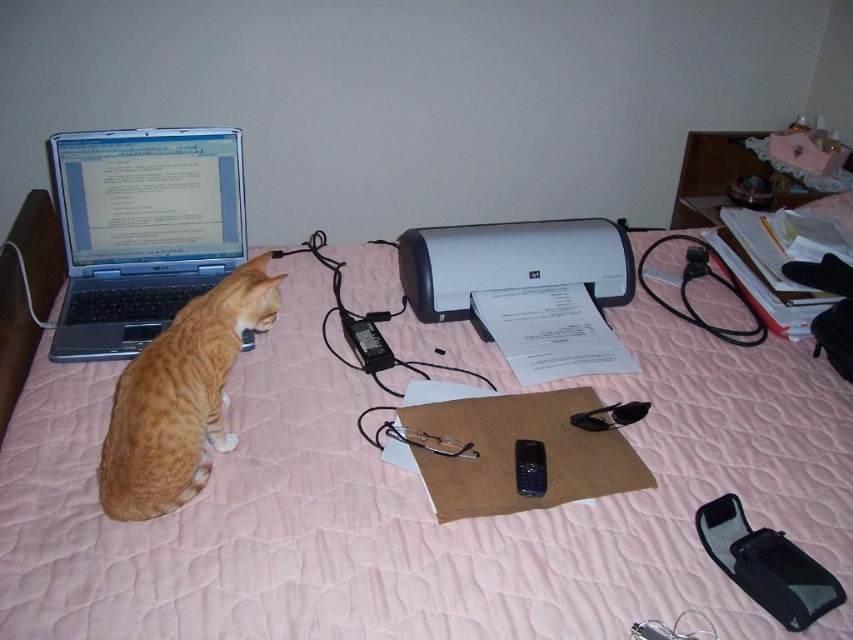
Question: Based on their relative distances, which object is farther from the orange fur cat at left?

Choices:
 (A) matte silver laptop at left
 (B) white plastic printer at center
 (C) black plastic phone at center

Answer: (B)

Question: Is matte silver laptop at left below black plastic phone at center?

Choices:
 (A) yes
 (B) no

Answer: (B)

Question: Does matte silver laptop at left have a smaller size compared to black plastic phone at center?

Choices:
 (A) yes
 (B) no

Answer: (B)

Question: Which is farther from the black plastic phone at center?

Choices:
 (A) orange fur cat at left
 (B) white plastic printer at center
 (C) matte silver laptop at left

Answer: (C)

Question: Is matte silver laptop at left below white plastic printer at center?

Choices:
 (A) no
 (B) yes

Answer: (A)

Question: Which object is the closest to the orange fur cat at left?

Choices:
 (A) black plastic phone at center
 (B) white plastic printer at center
 (C) matte silver laptop at left

Answer: (C)